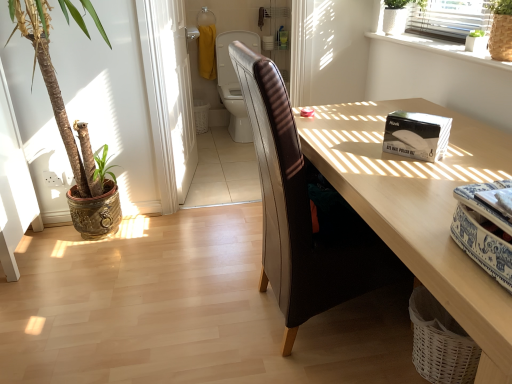
This screenshot has width=512, height=384. I want to click on free space to the left of leather at center, so click(195, 317).